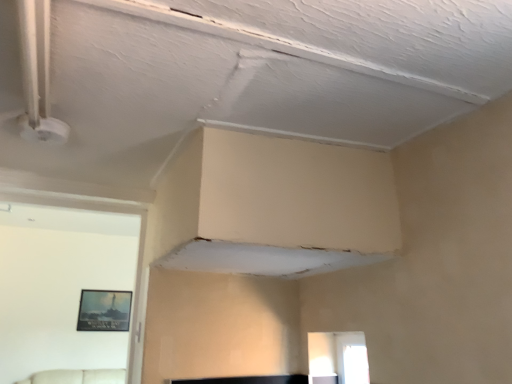
Question: Is transparent glass window at lower right inside the boundaries of matte black picture frame at left, or outside?

Choices:
 (A) inside
 (B) outside

Answer: (B)

Question: Is point (339, 339) closer or farther from the camera than point (89, 302)?

Choices:
 (A) closer
 (B) farther

Answer: (A)

Question: Considering their positions, is transparent glass window at lower right located in front of or behind matte black picture frame at left?

Choices:
 (A) front
 (B) behind

Answer: (A)

Question: Considering the positions of matte black picture frame at left and transparent glass window at lower right in the image, is matte black picture frame at left wider or thinner than transparent glass window at lower right?

Choices:
 (A) wide
 (B) thin

Answer: (B)

Question: Considering the positions of matte black picture frame at left and transparent glass window at lower right in the image, is matte black picture frame at left taller or shorter than transparent glass window at lower right?

Choices:
 (A) short
 (B) tall

Answer: (B)

Question: Considering their positions, is matte black picture frame at left located in front of or behind transparent glass window at lower right?

Choices:
 (A) behind
 (B) front

Answer: (A)

Question: From a real-world perspective, is matte black picture frame at left above or below transparent glass window at lower right?

Choices:
 (A) below
 (B) above

Answer: (B)